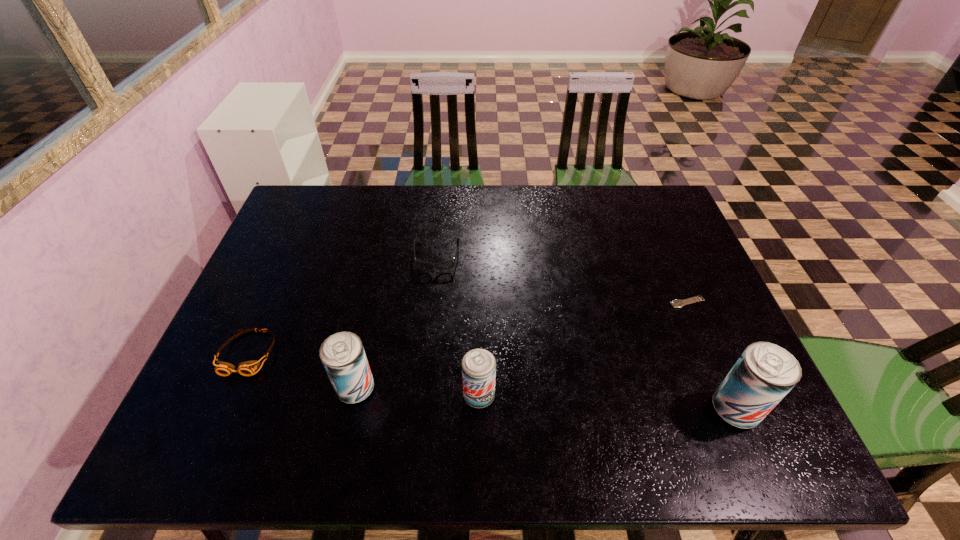
Identify the location of free space between the leftmost object and the leftmost beer can. The image size is (960, 540). (301, 371).

Find the location of `free space between the fourth shortest object and the farthest object`. free space between the fourth shortest object and the farthest object is located at coordinates (458, 326).

The image size is (960, 540). I want to click on empty space that is in between the watch and the leftmost beer can, so click(x=521, y=346).

At what (x,y) coordinates should I click in order to perform the action: click on free spot between the second farthest object and the rightmost beer can. Please return your answer as a coordinate pair (x, y). This screenshot has width=960, height=540. Looking at the image, I should click on (711, 356).

Select which object appears as the fifth closest to the spectacles. Please provide its 2D coordinates. Your answer should be formatted as a tuple, i.e. [(x, y)], where the tuple contains the x and y coordinates of a point satisfying the conditions above.

[(764, 374)]

Identify which object is located as the third nearest to the second beer can from left to right. Please provide its 2D coordinates. Your answer should be formatted as a tuple, i.e. [(x, y)], where the tuple contains the x and y coordinates of a point satisfying the conditions above.

[(247, 368)]

Locate an element on the screen. beer can that is the second closest to the shortest object is located at coordinates (478, 365).

At what (x,y) coordinates should I click in order to perform the action: click on beer can object that ranks as the third closest to the third object from left to right. Please return your answer as a coordinate pair (x, y). Looking at the image, I should click on (764, 374).

Locate an element on the screen. Image resolution: width=960 pixels, height=540 pixels. vacant point that satisfies the following two spatial constraints: 1. on the front-facing side of the rightmost beer can; 2. on the left side of the farthest object is located at coordinates click(421, 409).